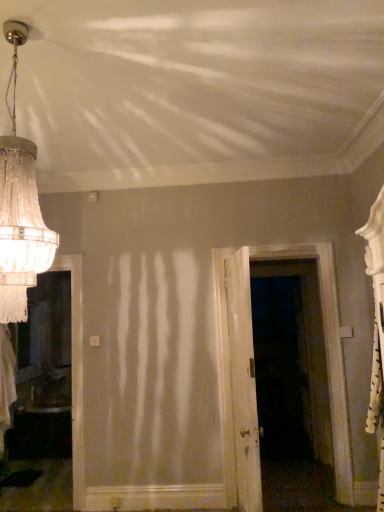
Question: From a real-world perspective, is white wooden door at center, acting as the second door starting from the left, located beneath crystal glass chandelier at upper left?

Choices:
 (A) yes
 (B) no

Answer: (A)

Question: Is white wooden door at center, acting as the second door starting from the left, wider than crystal glass chandelier at upper left?

Choices:
 (A) yes
 (B) no

Answer: (B)

Question: Would you say white wooden door at center, acting as the second door starting from the left, contains crystal glass chandelier at upper left?

Choices:
 (A) no
 (B) yes

Answer: (A)

Question: Is white wooden door at center, acting as the second door starting from the left, closer to camera compared to crystal glass chandelier at upper left?

Choices:
 (A) yes
 (B) no

Answer: (B)

Question: Considering the relative positions of white wooden door at center, acting as the second door starting from the left, and crystal glass chandelier at upper left in the image provided, is white wooden door at center, acting as the second door starting from the left, to the right of crystal glass chandelier at upper left from the viewer's perspective?

Choices:
 (A) no
 (B) yes

Answer: (B)

Question: From the image's perspective, is white wooden door at center, acting as the second door starting from the left, above or below crystal glass chandelier at upper left?

Choices:
 (A) below
 (B) above

Answer: (A)

Question: From a real-world perspective, is white wooden door at center, acting as the second door starting from the left, physically located above or below crystal glass chandelier at upper left?

Choices:
 (A) above
 (B) below

Answer: (B)

Question: Is point (228, 484) positioned closer to the camera than point (3, 247)?

Choices:
 (A) closer
 (B) farther

Answer: (B)

Question: Looking at the image, does white wooden door at center, which ranks as the 1th door in right-to-left order, seem bigger or smaller compared to crystal glass chandelier at upper left?

Choices:
 (A) small
 (B) big

Answer: (B)

Question: From the image's perspective, relative to white wood door at center, which is counted as the first door, starting from the left, is white wooden door at center, which ranks as the 1th door in right-to-left order, above or below?

Choices:
 (A) above
 (B) below

Answer: (A)

Question: Based on their sizes in the image, would you say white wooden door at center, which ranks as the 1th door in right-to-left order, is bigger or smaller than white wood door at center, the second door positioned from the right?

Choices:
 (A) big
 (B) small

Answer: (A)

Question: From their relative heights in the image, would you say white wooden door at center, acting as the second door starting from the left, is taller or shorter than white wood door at center, the second door positioned from the right?

Choices:
 (A) tall
 (B) short

Answer: (A)

Question: Choose the correct answer: Is white wooden door at center, which ranks as the 1th door in right-to-left order, inside white wood door at center, which is counted as the first door, starting from the left, or outside it?

Choices:
 (A) inside
 (B) outside

Answer: (B)

Question: From a real-world perspective, relative to white wooden door at center, acting as the second door starting from the left, is crystal glass chandelier at upper left vertically above or below?

Choices:
 (A) above
 (B) below

Answer: (A)

Question: Considering the positions of point (36, 267) and point (223, 316), is point (36, 267) closer or farther from the camera than point (223, 316)?

Choices:
 (A) closer
 (B) farther

Answer: (A)